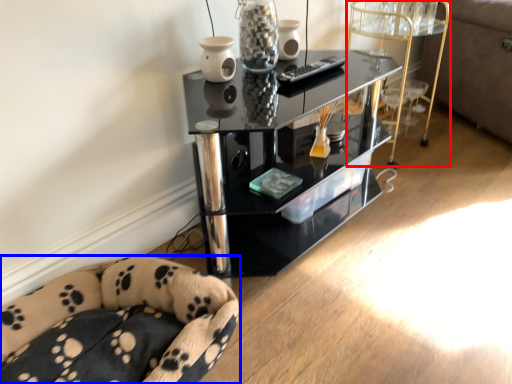
Question: Which object appears closest to the camera in this image, side table (highlighted by a red box) or furniture (highlighted by a blue box)?

Choices:
 (A) side table
 (B) furniture

Answer: (B)